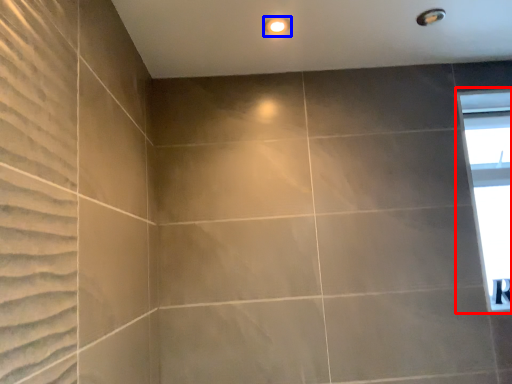
Question: Which point is closer to the camera, window (highlighted by a red box) or lighting (highlighted by a blue box)?

Choices:
 (A) window
 (B) lighting

Answer: (B)